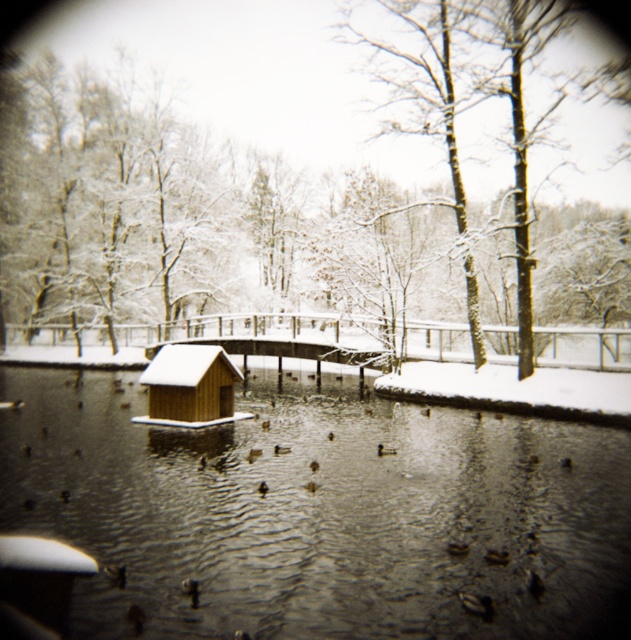
Between snow-covered tree at center and brown matte duck at center, which one has less height?

Standing shorter between the two is brown matte duck at center.

Can you confirm if snow-covered tree at center is positioned below brown matte duck at center?

No, snow-covered tree at center is not below brown matte duck at center.

Is point (599, 4) positioned before point (285, 445)?

No, it is behind (285, 445).

Identify the location of snow-covered tree at center. This screenshot has width=631, height=640. click(20, 17).

Does smooth water at center have a greater height compared to wooden hut at center?

Yes.

Is smooth water at center wider than wooden hut at center?

Yes, smooth water at center is wider than wooden hut at center.

Locate an element on the screen. smooth water at center is located at coordinates [321, 513].

Find the location of `smooth water at center`. smooth water at center is located at coordinates (321, 513).

Does wooden hut at center have a larger size compared to snow-covered tree at center?

No, wooden hut at center is not bigger than snow-covered tree at center.

Who is shorter, wooden hut at center or snow-covered tree at center?

Standing shorter between the two is wooden hut at center.

The image size is (631, 640). Identify the location of wooden hut at center. (189, 387).